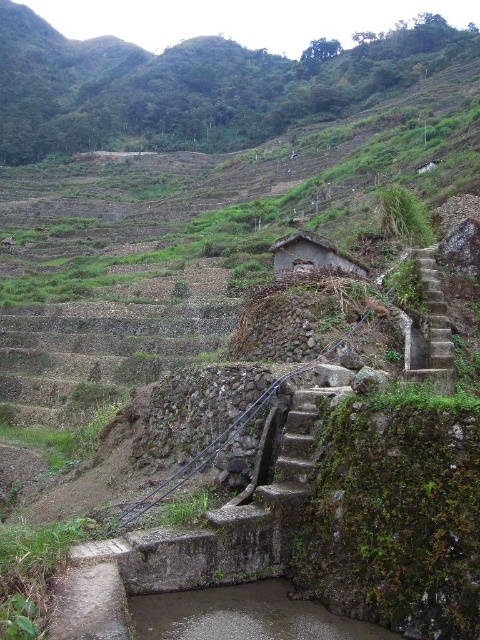
From the picture: You are standing at the bottom of the stone steps and want to reach the small rustic structure at the top. There are two points marked on the path, one at coordinates point (439, 392) and another at point (336, 268). Which point should you look towards first to stay on the correct path?

You should look towards point (439, 392) first because it is in front of point (336, 268) along the path.